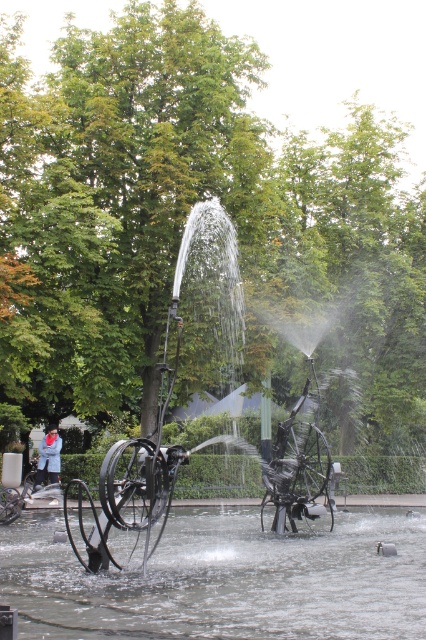
Is black metal sculpture at center to the left of clear water at center from the viewer's perspective?

Correct, you'll find black metal sculpture at center to the left of clear water at center.

Can you confirm if black metal sculpture at center is bigger than clear water at center?

Yes.

Between point (121, 604) and point (403, 628), which one is positioned behind?

Point (121, 604)

At what (x,y) coordinates should I click in order to perform the action: click on black metal sculpture at center. Please return your answer as a coordinate pair (x, y). This screenshot has width=426, height=640. Looking at the image, I should click on (224, 579).

Between clear water at center and silver metallic bicycle at lower left, which one is positioned higher?

clear water at center

How much distance is there between clear water at center and silver metallic bicycle at lower left?

6.55 meters

The width and height of the screenshot is (426, 640). What do you see at coordinates (224, 579) in the screenshot?
I see `clear water at center` at bounding box center [224, 579].

Identify the location of clear water at center. (224, 579).

Between point (267, 580) and point (55, 483), which one is positioned behind?

Positioned behind is point (55, 483).

Between point (267, 584) and point (34, 476), which one is positioned behind?

The point (34, 476) is more distant.

Where is `black metal sculpture at center`? This screenshot has width=426, height=640. black metal sculpture at center is located at coordinates coord(224,579).